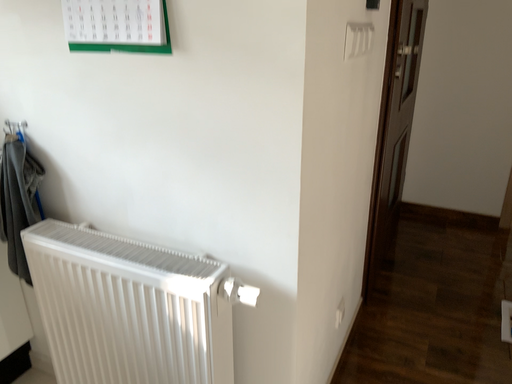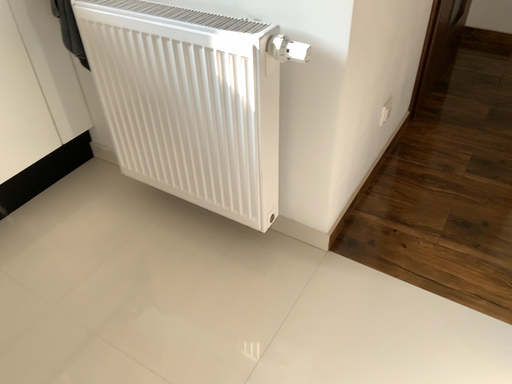
Question: Which way did the camera rotate in the video?

Choices:
 (A) rotated downward
 (B) rotated upward

Answer: (A)